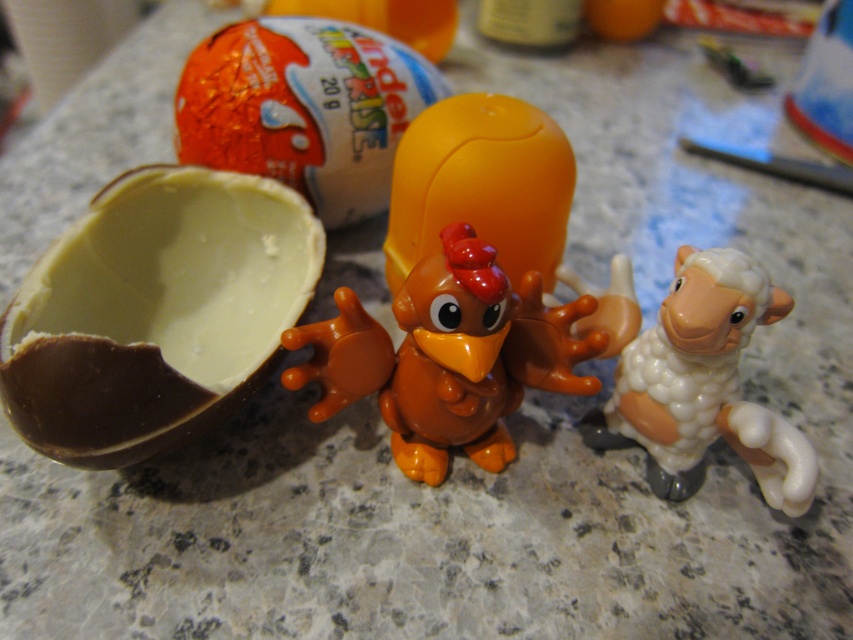
Looking at this image, you are a child who just found the shiny chocolate egg at center and the orange matte plastic chicken at center. Which toy is closer to the bottom of the image?

The orange matte plastic chicken at center is located below the shiny chocolate egg at center, so it is closer to the bottom of the image.

You want to place both the smooth chocolate egg at center and the orange matte plastic chicken at center into a gift box. The box can only hold items that are smaller than 15 centimeters in width. Based on the scene description, will both items fit?

→ The smooth chocolate egg at center is larger than the orange matte plastic chicken at center. However, since the box can hold items smaller than 15 centimeters, both items may fit as long as the chocolate egg is under 15 cm. But without exact measurements, we can only confirm the chicken is smaller than the egg.

You are a child who wants to open the smooth chocolate egg at center and the shiny chocolate egg at center. Which one can you reach first if you are standing in front of both?

The smooth chocolate egg at center is positioned under the shiny chocolate egg at center, so you can reach the shiny chocolate egg at center first because it is higher up.